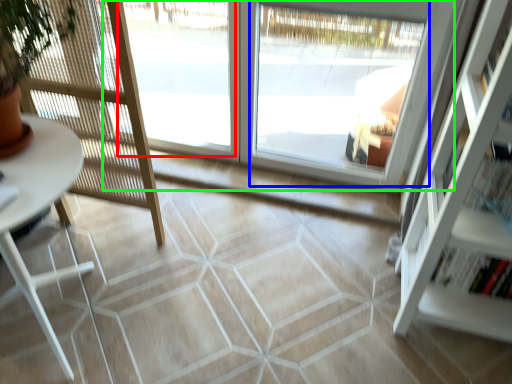
Question: Considering the real-world distances, which object is farthest from window (highlighted by a red box)? window (highlighted by a blue box) or window (highlighted by a green box)?

Choices:
 (A) window
 (B) window

Answer: (A)